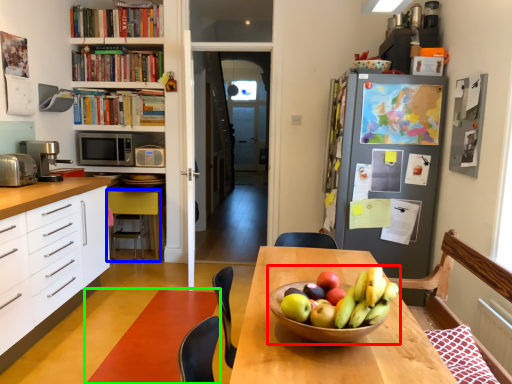
Question: Based on their relative distances, which object is farther from fruit dish (highlighted by a red box)? Choose from chair (highlighted by a blue box) and strip (highlighted by a green box).

Choices:
 (A) chair
 (B) strip

Answer: (A)